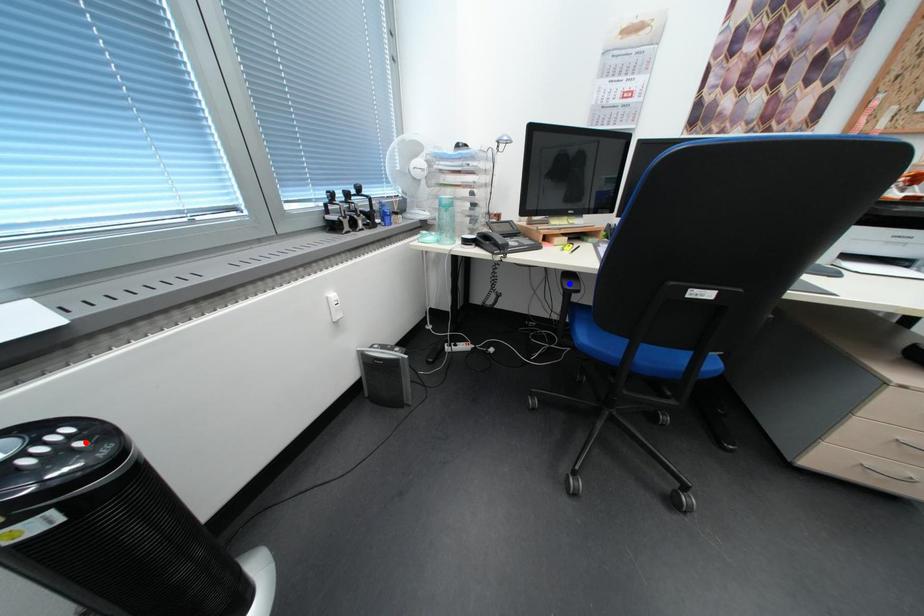
Question: Two points are marked on the image. Which point is closer to the camera?

Choices:
 (A) Blue point is closer.
 (B) Red point is closer.

Answer: (B)